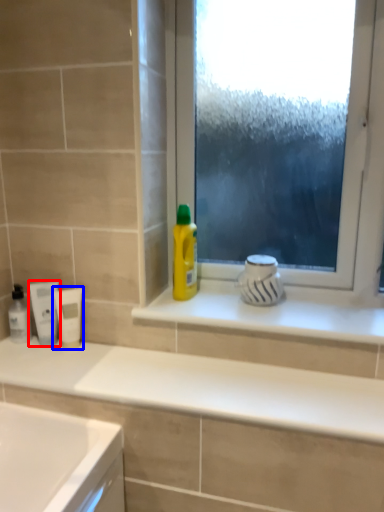
Question: Which object appears closest to the camera in this image, mouthwash (highlighted by a red box) or mouthwash (highlighted by a blue box)?

Choices:
 (A) mouthwash
 (B) mouthwash

Answer: (B)